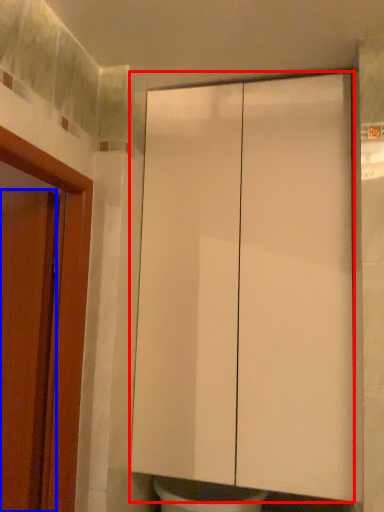
Question: Which object appears farthest to the camera in this image, cabinetry (highlighted by a red box) or door (highlighted by a blue box)?

Choices:
 (A) cabinetry
 (B) door

Answer: (A)